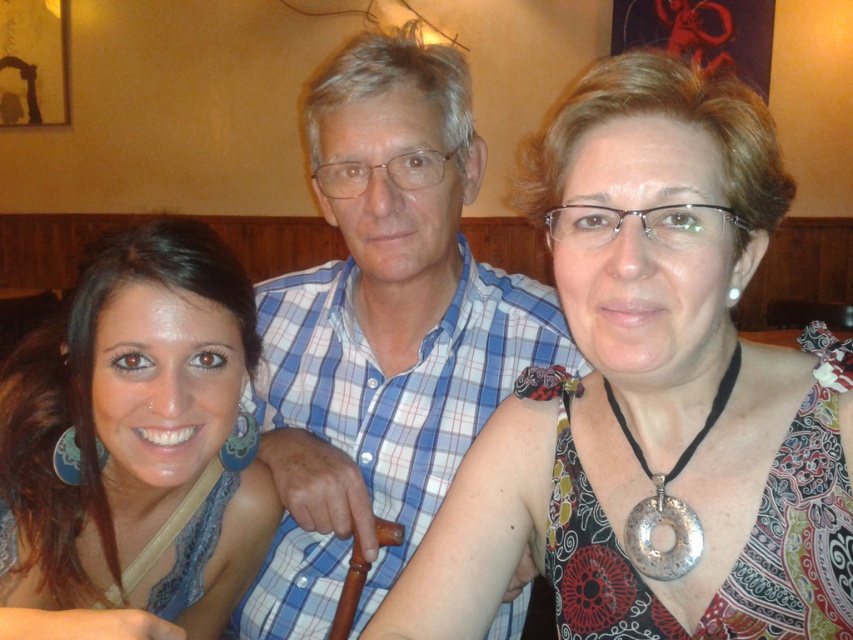
Question: Observing the image, what is the correct spatial positioning of patterned fabric dress at center in reference to matte blue dress at center?

Choices:
 (A) below
 (B) above

Answer: (B)

Question: Which point is farther to the camera?

Choices:
 (A) (109, 552)
 (B) (769, 586)

Answer: (A)

Question: Does patterned fabric dress at center appear on the right side of matte blue dress at center?

Choices:
 (A) yes
 (B) no

Answer: (A)

Question: Does patterned fabric dress at center appear on the right side of matte blue dress at center?

Choices:
 (A) no
 (B) yes

Answer: (B)

Question: Which object appears closest to the camera in this image?

Choices:
 (A) blue checkered shirt at center
 (B) matte blue dress at center
 (C) patterned fabric dress at center

Answer: (C)

Question: Which object appears closest to the camera in this image?

Choices:
 (A) blue checkered shirt at center
 (B) patterned fabric dress at center

Answer: (B)